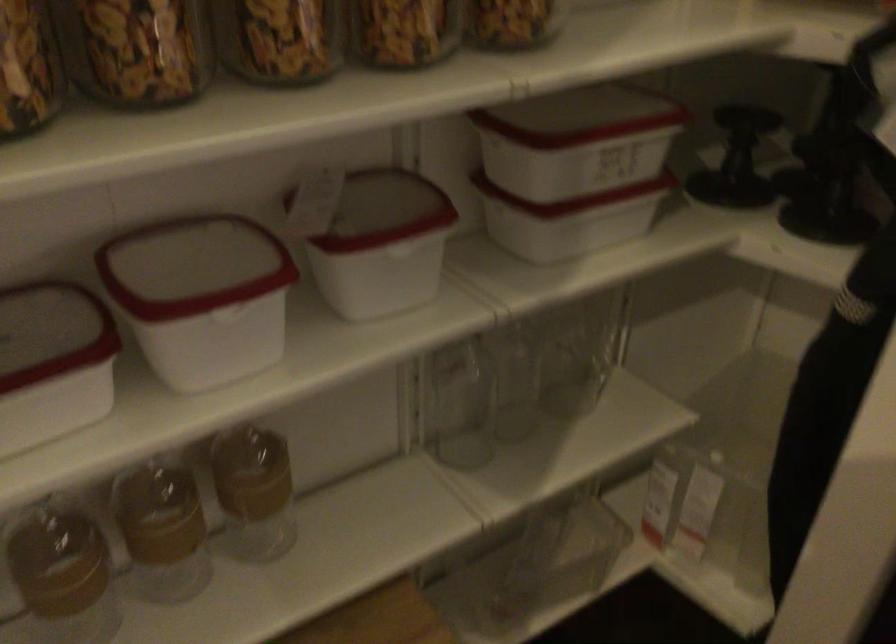
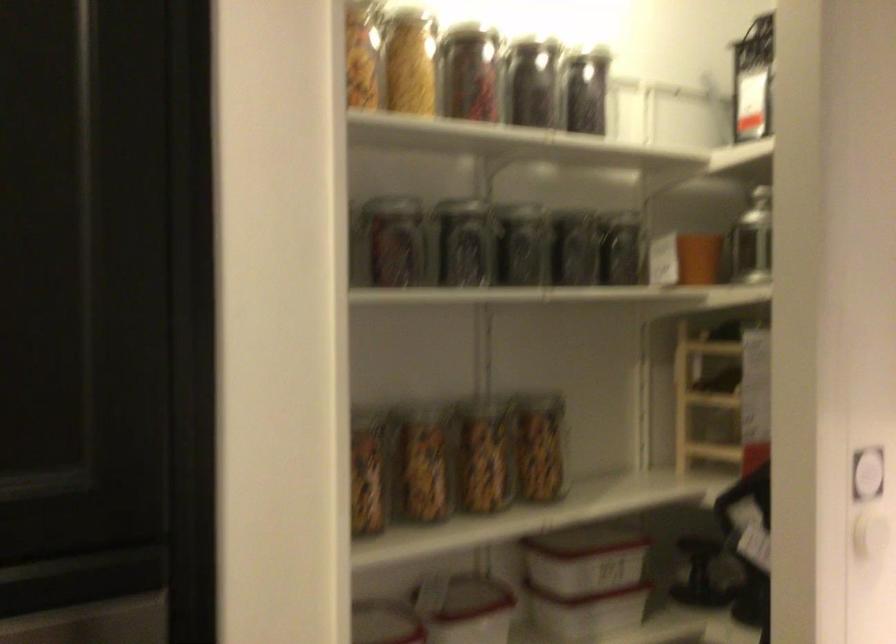
The point at (571, 162) is marked in the first image. Where is the corresponding point in the second image?

(582, 572)